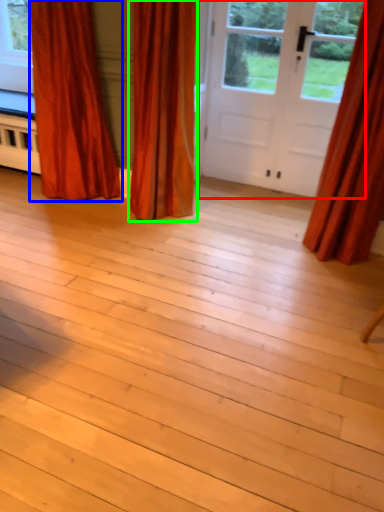
Question: Considering the real-world distances, which object is closest to door (highlighted by a red box)? curtain (highlighted by a blue box) or curtain (highlighted by a green box).

Choices:
 (A) curtain
 (B) curtain

Answer: (B)